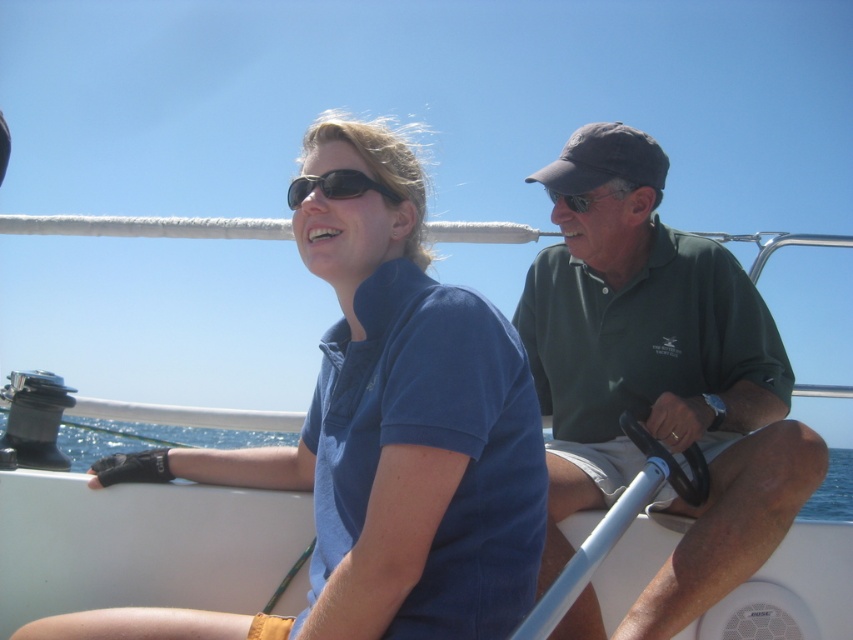
What is the location of the blue water at lower left in the image?

The blue water at lower left is located at point [149,438].

In the scene shown: You are a photographer trying to capture the reflection of the blue water at lower left and the matte black sunglasses at center in the boat scene. Since you want to focus on both objects, which one should you adjust your camera settings for to ensure proper exposure, considering their sizes?

The blue water at lower left is larger than the matte black sunglasses at center, so you should adjust your camera settings to prioritize the exposure for the blue water at lower left to account for its larger area.